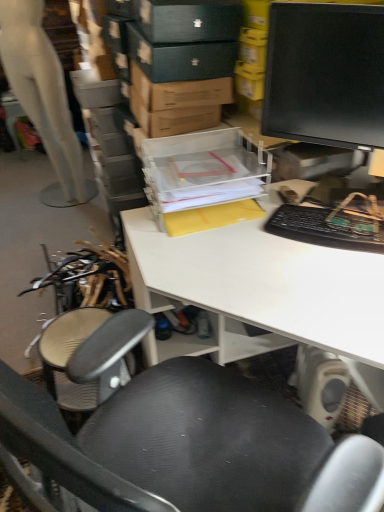
The image size is (384, 512). Find the location of `free spot above black plastic keyboard at right (from a real-world perspective)`. free spot above black plastic keyboard at right (from a real-world perspective) is located at coordinates (327, 222).